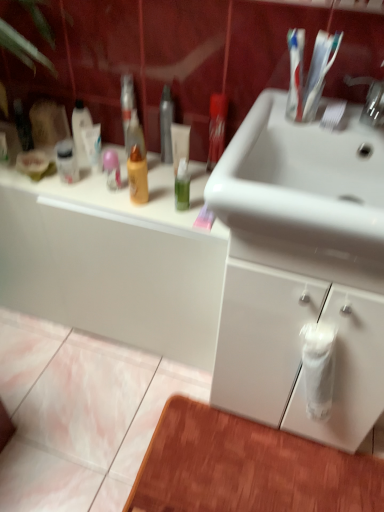
Question: Is white glossy sink at upper center facing towards white glossy cabinet at lower right, placed as the 1th bathroom cabinet when sorted from right to left?

Choices:
 (A) yes
 (B) no

Answer: (B)

Question: Can you confirm if white glossy sink at upper center is positioned to the right of white glossy cabinet at lower right, placed as the 1th bathroom cabinet when sorted from right to left?

Choices:
 (A) no
 (B) yes

Answer: (A)

Question: Does white glossy sink at upper center touch white glossy cabinet at lower right, placed as the 1th bathroom cabinet when sorted from right to left?

Choices:
 (A) yes
 (B) no

Answer: (B)

Question: Does white glossy sink at upper center have a smaller size compared to white glossy cabinet at lower right, placed as the 1th bathroom cabinet when sorted from right to left?

Choices:
 (A) yes
 (B) no

Answer: (A)

Question: Is white glossy sink at upper center oriented away from white glossy cabinet at lower right, arranged as the second bathroom cabinet when viewed from the left?

Choices:
 (A) no
 (B) yes

Answer: (A)

Question: Does point (243, 249) appear closer or farther from the camera than point (203, 344)?

Choices:
 (A) closer
 (B) farther

Answer: (A)

Question: Which is correct: white glossy sink at upper center is inside white glossy cabinet at lower left, which is counted as the second bathroom cabinet, starting from the right, or outside of it?

Choices:
 (A) outside
 (B) inside

Answer: (A)

Question: Looking at their shapes, would you say white glossy sink at upper center is wider or thinner than white glossy cabinet at lower left, arranged as the 1th bathroom cabinet when viewed from the left?

Choices:
 (A) thin
 (B) wide

Answer: (B)

Question: Relative to white glossy cabinet at lower left, which is counted as the second bathroom cabinet, starting from the right, is white glossy sink at upper center in front or behind?

Choices:
 (A) behind
 (B) front

Answer: (B)

Question: Considering their positions, is white glossy cabinet at lower right, placed as the 1th bathroom cabinet when sorted from right to left, located in front of or behind white glossy sink at upper center?

Choices:
 (A) front
 (B) behind

Answer: (B)

Question: From the image's perspective, relative to white glossy sink at upper center, is white glossy cabinet at lower right, placed as the 1th bathroom cabinet when sorted from right to left, above or below?

Choices:
 (A) above
 (B) below

Answer: (B)

Question: Is white glossy cabinet at lower right, arranged as the second bathroom cabinet when viewed from the left, spatially inside white glossy sink at upper center, or outside of it?

Choices:
 (A) inside
 (B) outside

Answer: (B)

Question: From a real-world perspective, is white glossy cabinet at lower right, arranged as the second bathroom cabinet when viewed from the left, above or below white glossy sink at upper center?

Choices:
 (A) below
 (B) above

Answer: (A)

Question: From a real-world perspective, is white glossy cabinet at lower left, arranged as the 1th bathroom cabinet when viewed from the left, above or below white glossy cabinet at lower right, placed as the 1th bathroom cabinet when sorted from right to left?

Choices:
 (A) below
 (B) above

Answer: (A)

Question: Based on their sizes in the image, would you say white glossy cabinet at lower left, arranged as the 1th bathroom cabinet when viewed from the left, is bigger or smaller than white glossy cabinet at lower right, placed as the 1th bathroom cabinet when sorted from right to left?

Choices:
 (A) big
 (B) small

Answer: (A)